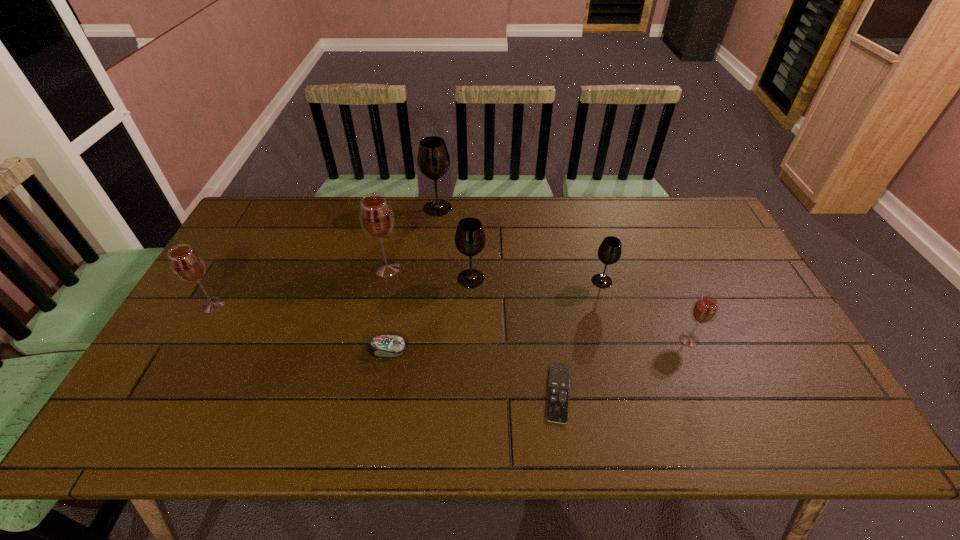
This screenshot has height=540, width=960. Identify the location of vacant area that lies between the second biggest gray wineglass and the computer mouse. (429, 314).

Locate an element on the screen. This screenshot has height=540, width=960. unoccupied area between the nearest wineglass and the smallest gray wineglass is located at coordinates (645, 310).

Where is `free space that is in between the nearest red wineglass and the second wineglass from left to right`? Image resolution: width=960 pixels, height=540 pixels. free space that is in between the nearest red wineglass and the second wineglass from left to right is located at coordinates pos(539,304).

The width and height of the screenshot is (960, 540). I want to click on object that is the second closest to the second shortest object, so click(x=376, y=216).

The height and width of the screenshot is (540, 960). Identify the location of object that is the fifth closest to the biggest gray wineglass. (187, 264).

Select which wineglass is the closest to the fifth farthest wineglass. Please provide its 2D coordinates. Your answer should be formatted as a tuple, i.e. [(x, y)], where the tuple contains the x and y coordinates of a point satisfying the conditions above.

[(376, 216)]

Identify which wineglass is located as the nearest to the second shortest object. Please provide its 2D coordinates. Your answer should be formatted as a tuple, i.e. [(x, y)], where the tuple contains the x and y coordinates of a point satisfying the conditions above.

[(470, 239)]

Locate an element on the screen. This screenshot has height=540, width=960. gray wineglass that is the nearest to the remote control is located at coordinates [x=609, y=252].

Identify the location of gray wineglass that is the second closest to the leftmost object. This screenshot has width=960, height=540. (470, 239).

Select which red wineglass is the closest to the remote control. Please provide its 2D coordinates. Your answer should be formatted as a tuple, i.e. [(x, y)], where the tuple contains the x and y coordinates of a point satisfying the conditions above.

[(705, 309)]